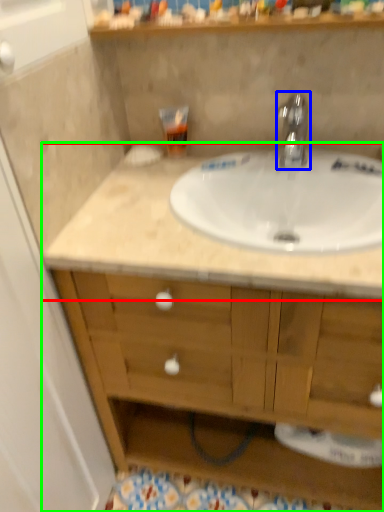
Question: Which object is positioned closest to countertop (highlighted by a red box)? Select from tap (highlighted by a blue box) and bathroom cabinet (highlighted by a green box).

Choices:
 (A) tap
 (B) bathroom cabinet

Answer: (B)